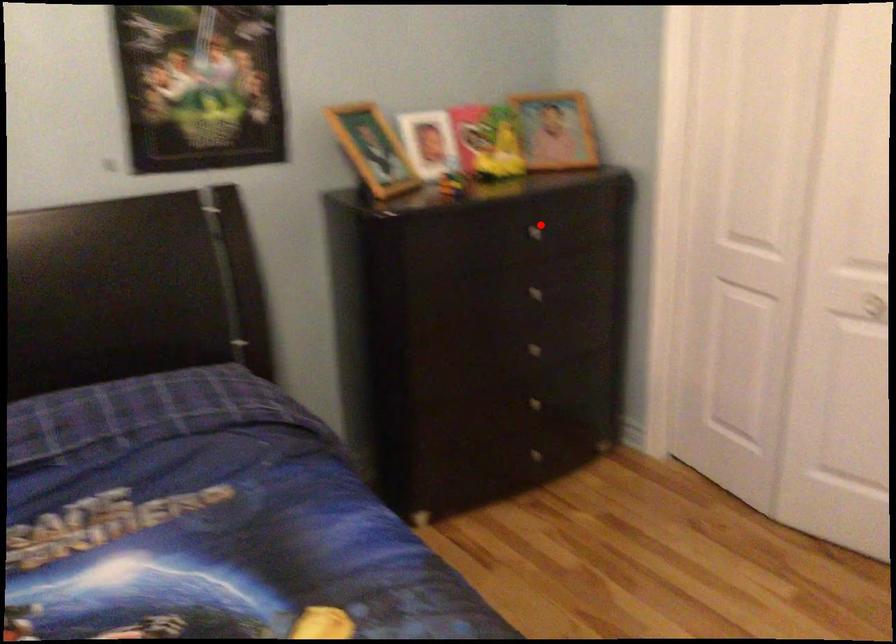
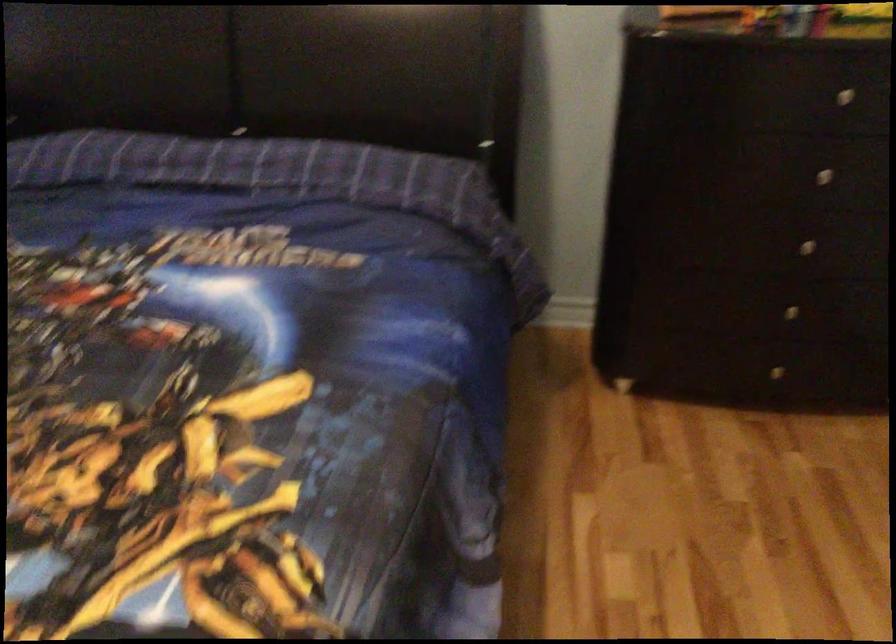
Question: I am providing you with two images of the same scene from different viewpoints. A red point is shown in image1. For the corresponding object point in image2, is it positioned nearer or farther from the camera?

Choices:
 (A) Nearer
 (B) Farther

Answer: (A)